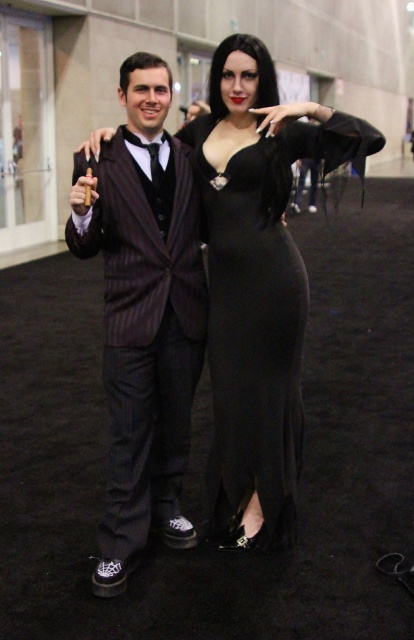
You are a photographer setting up for a photoshoot. You need to position a spotlight so that it can illuminate both the matte black dress at center and the black satin dress at center without casting shadows on the background. Given their height difference, which dress should the spotlight be angled towards first?

The spotlight should be angled towards the matte black dress at center first since it is much taller than the black satin dress at center, ensuring both are properly illuminated without shadows on the background.

You are a photographer setting up for a photoshoot. You need to ensure that the distance between the pinstriped suit at center and the black satin dress at center is exactly 25 centimeters for the perfect composition. Based on the current setup, is the distance sufficient or does it need adjustment?

The pinstriped suit at center is 23.91 centimeters away from the black satin dress at center, which is slightly less than the required 25 centimeters. The photographer should adjust the distance by moving them apart by approximately 1.09 centimeters to achieve the desired composition.

You are a photographer setting up for a photoshoot. You need to position a spotlight so that it illuminates both the matte black dress at center and the pinstriped suit at center without any shadows. Considering their heights, which object should the spotlight be angled towards first?

The spotlight should be angled towards the matte black dress at center first since it is taller than the pinstriped suit at center, ensuring both are illuminated properly.